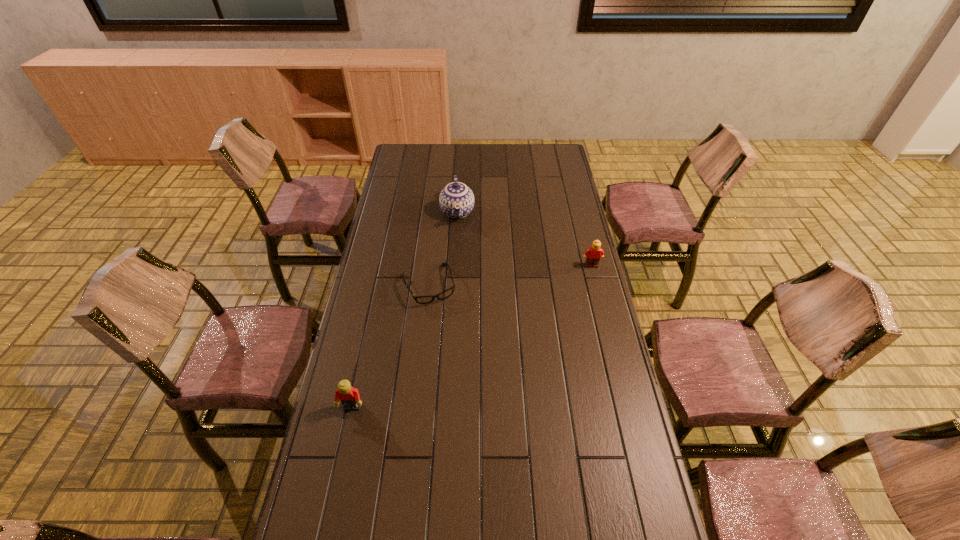
This screenshot has width=960, height=540. I want to click on vacant space at the right edge of the desktop, so click(x=545, y=200).

Locate an element on the screen. vacant space at the far left corner of the desktop is located at coordinates (420, 157).

The height and width of the screenshot is (540, 960). I want to click on free space that is in between the left Lego and the shortest object, so point(391,346).

Locate an element on the screen. This screenshot has height=540, width=960. free area in between the nearer Lego and the spectacles is located at coordinates (391, 346).

Find the location of a particular element. Image resolution: width=960 pixels, height=540 pixels. vacant space that is in between the shortest object and the farthest object is located at coordinates (444, 248).

At what (x,y) coordinates should I click in order to perform the action: click on free space between the nearer Lego and the rightmost object. Please return your answer as a coordinate pair (x, y). This screenshot has width=960, height=540. Looking at the image, I should click on (471, 336).

At what (x,y) coordinates should I click in order to perform the action: click on vacant point located between the leftmost object and the spectacles. Please return your answer as a coordinate pair (x, y). This screenshot has width=960, height=540. Looking at the image, I should click on (391, 346).

Find the location of `vacant space that's between the shortest object and the chinaware`. vacant space that's between the shortest object and the chinaware is located at coordinates (444, 248).

At what (x,y) coordinates should I click in order to perform the action: click on vacant space in between the tallest object and the rightmost object. Please return your answer as a coordinate pair (x, y). Looking at the image, I should click on (524, 239).

What are the coordinates of `vacant space that is in between the nearest object and the shortest object` in the screenshot? It's located at (391, 346).